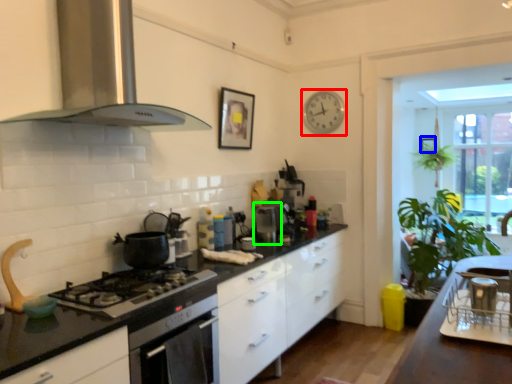
Question: Estimate the real-world distances between objects in this image. Which object is closer to clock (highlighted by a red box), picture frame (highlighted by a blue box) or appliance (highlighted by a green box)?

Choices:
 (A) picture frame
 (B) appliance

Answer: (B)